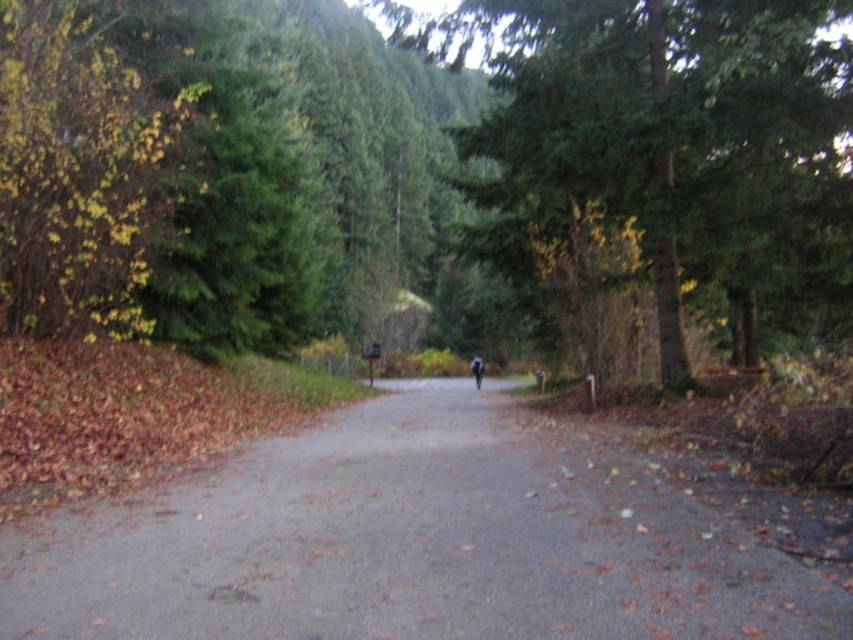
You are a hiker who wants to cross the gray asphalt road at center and reach the green matte tree at center. Which object is narrower so you can easily walk through?

The gray asphalt road at center is smaller than green matte tree at center, so it is narrower and easier to walk through.

You are standing at the center of the gray asphalt road at center and dark blue fabric at center. Which object is positioned to the left?

The gray asphalt road at center is to the left of the dark blue fabric at center.